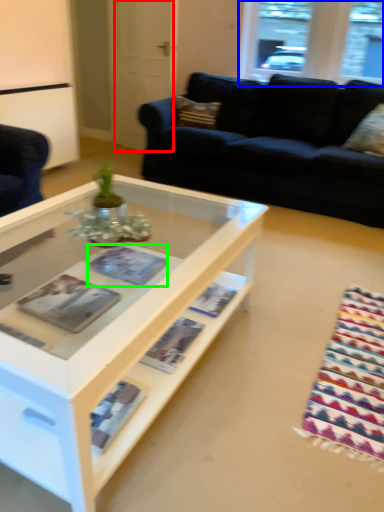
Question: Based on their relative distances, which object is nearer to glass door (highlighted by a red box)? Choose from window (highlighted by a blue box) and magazine (highlighted by a green box).

Choices:
 (A) window
 (B) magazine

Answer: (A)